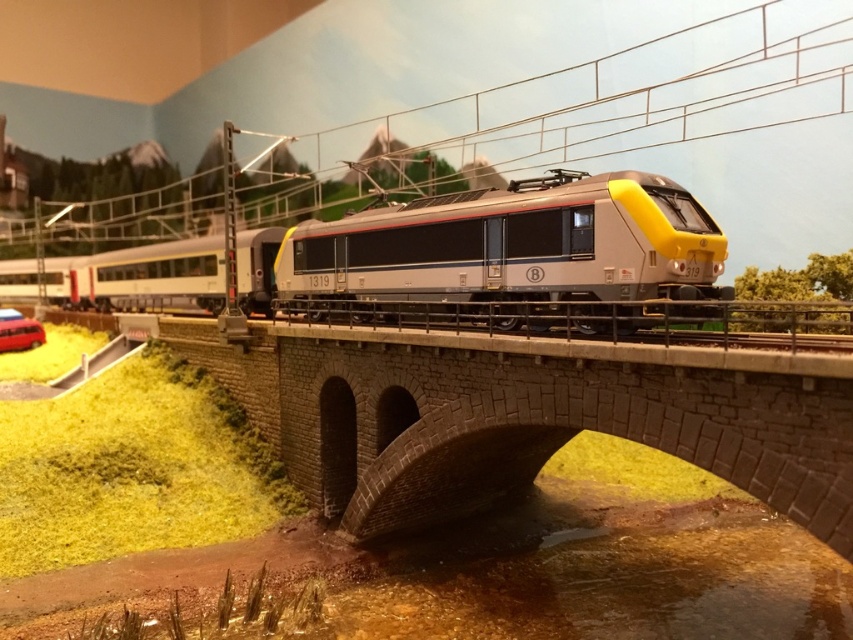
You are standing at the camera position observing the model railway scene. There is a specific point marked at coordinates point (257,385). If you want to place a small decorative tree at this point, how far in meters should you place it from your current position?

The point (257,385) is 18.40 meters away from the camera, so you should place the small decorative tree at 18.40 meters from your current position.

You are a model railway enthusiast observing the scene. You notice the stone bridge at center and the metallic silver train at center. Which object is positioned closer to your viewpoint?

The stone bridge at center is closer to the viewer than the metallic silver train at center.